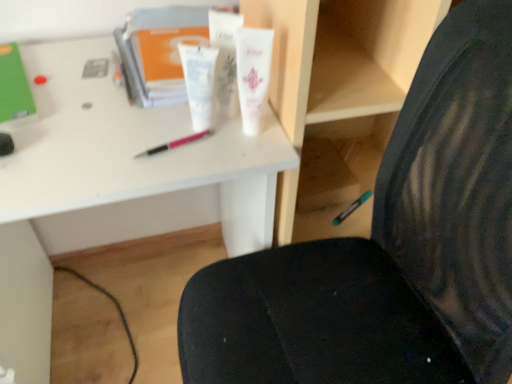
This screenshot has height=384, width=512. I want to click on vacant region to the left of pink plastic pen at center, so click(x=80, y=138).